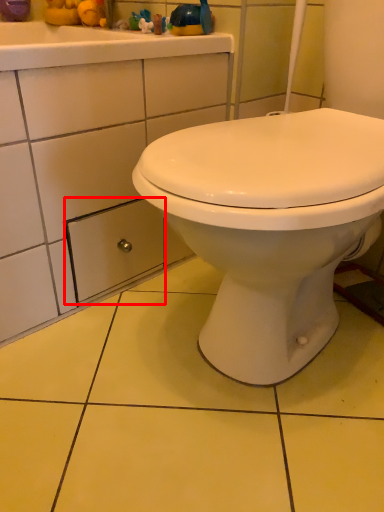
Question: In this image, where is drawer (annotated by the red box) located relative to toy?

Choices:
 (A) right
 (B) left

Answer: (B)